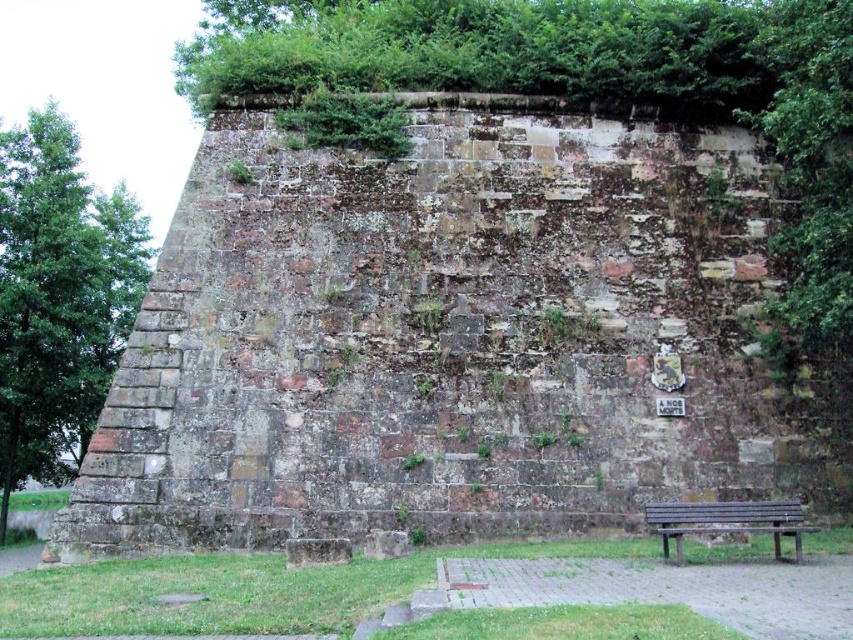
Is brown stone wall at center taller than green leafy tree at left?

In fact, brown stone wall at center may be shorter than green leafy tree at left.

Which is above, brown stone wall at center or green leafy tree at left?

green leafy tree at left is above.

Between point (524, 378) and point (80, 292), which one is positioned in front?

Point (524, 378)

The width and height of the screenshot is (853, 640). Identify the location of brown stone wall at center. pos(444,337).

Is point (451, 124) farther from camera compared to point (722, 525)?

Yes, it is behind point (722, 525).

This screenshot has width=853, height=640. Identify the location of brown stone wall at center. (444, 337).

Which is in front, point (610, 269) or point (781, 522)?

Point (781, 522) is in front.

Identify the location of brown stone wall at center. (444, 337).

Consider the image. Is green leafy tree at left below brown wooden bench at lower right?

No.

What do you see at coordinates (59, 298) in the screenshot? This screenshot has width=853, height=640. I see `green leafy tree at left` at bounding box center [59, 298].

The width and height of the screenshot is (853, 640). In order to click on green leafy tree at left in this screenshot , I will do `click(59, 298)`.